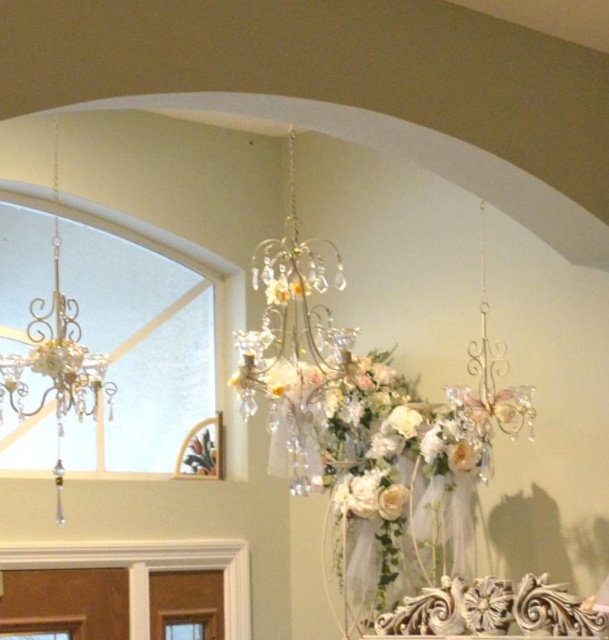
Question: Can you confirm if silver metallic chandelier at center is thinner than matte gold chandelier at left?

Choices:
 (A) yes
 (B) no

Answer: (B)

Question: From the image, what is the correct spatial relationship of ivory silk floral arrangement at center in relation to silver metallic chandelier at center?

Choices:
 (A) below
 (B) above

Answer: (A)

Question: Is silver metallic chandelier at center to the right of matte gold chandelier at left from the viewer's perspective?

Choices:
 (A) no
 (B) yes

Answer: (B)

Question: Which point is closer to the camera taking this photo?

Choices:
 (A) (33, 324)
 (B) (290, 394)
 (C) (440, 424)

Answer: (A)

Question: Considering the real-world distances, which object is closest to the silver metallic chandelier at center?

Choices:
 (A) ivory silk floral arrangement at center
 (B) matte gold chandelier at left

Answer: (A)

Question: Which object is farther from the camera taking this photo?

Choices:
 (A) silver metallic chandelier at center
 (B) ivory silk floral arrangement at center

Answer: (B)